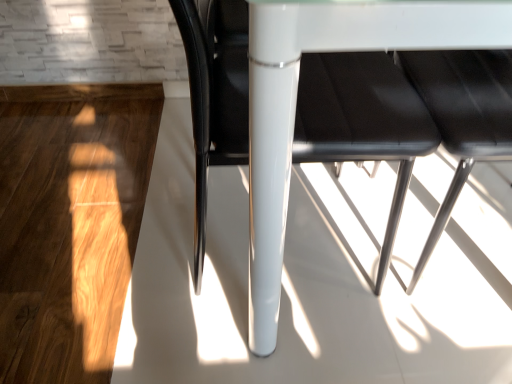
I want to click on free space that is to the left of glossy black chair at center, so click(x=99, y=235).